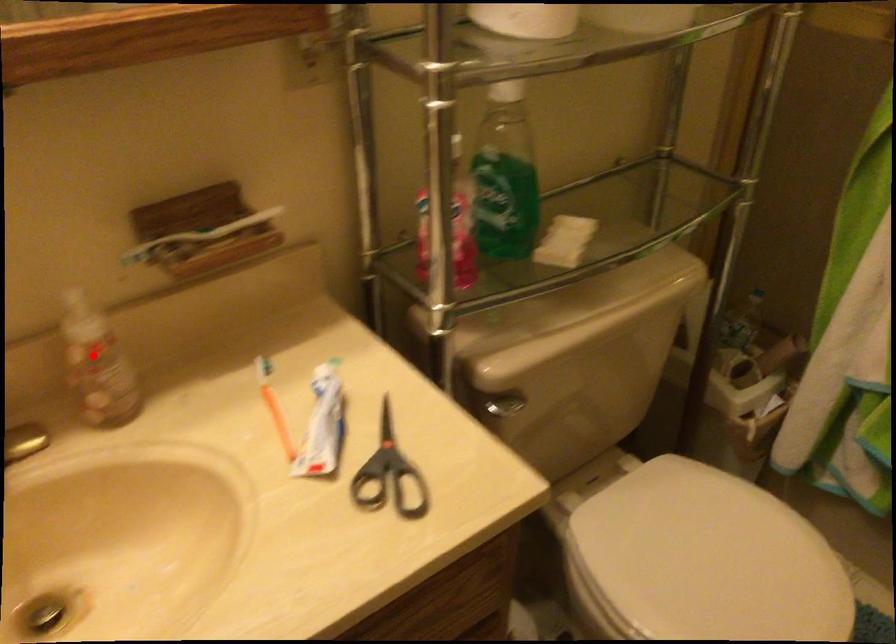
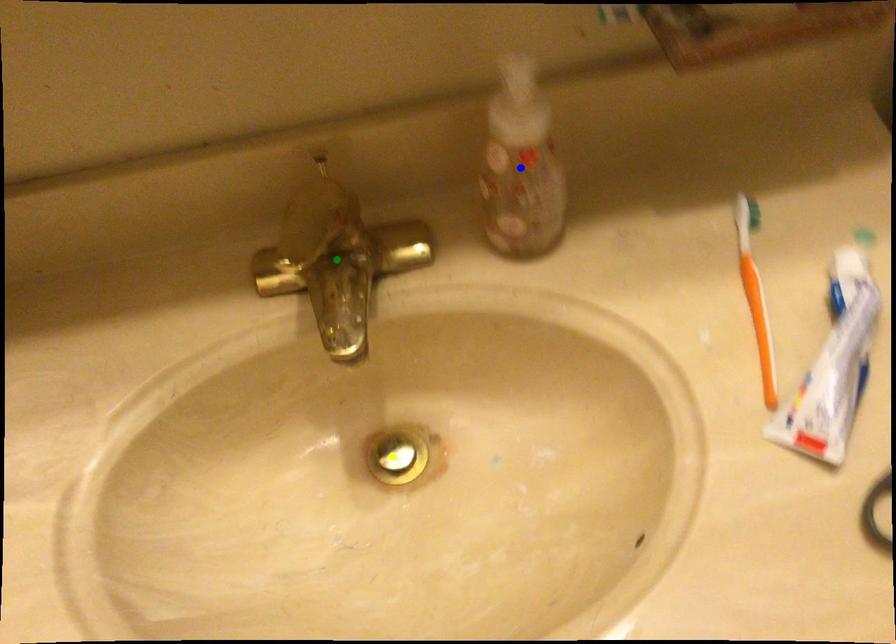
Question: I am providing you with two images of the same scene from different viewpoints. A red point is marked on the first image. You are given multiple points on the second image. Which point in image 2 represents the same 3d spot as the red point in image 1?

Choices:
 (A) green point
 (B) yellow point
 (C) blue point

Answer: (C)